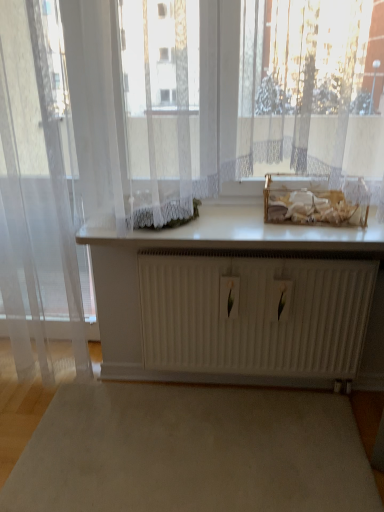
Question: Considering the relative positions of beige carpet at center and white glossy counter top at center in the image provided, is beige carpet at center in front of white glossy counter top at center?

Choices:
 (A) no
 (B) yes

Answer: (B)

Question: Does beige carpet at center appear on the left side of white glossy counter top at center?

Choices:
 (A) yes
 (B) no

Answer: (A)

Question: From the image's perspective, is beige carpet at center above white glossy counter top at center?

Choices:
 (A) yes
 (B) no

Answer: (B)

Question: Could you tell me if beige carpet at center is turned towards white glossy counter top at center?

Choices:
 (A) yes
 (B) no

Answer: (B)

Question: Is beige carpet at center at the right side of white glossy counter top at center?

Choices:
 (A) no
 (B) yes

Answer: (A)

Question: Is beige carpet at center positioned beyond the bounds of white glossy counter top at center?

Choices:
 (A) yes
 (B) no

Answer: (A)

Question: From a real-world perspective, is transparent fabric curtain at left under beige carpet at center?

Choices:
 (A) yes
 (B) no

Answer: (B)

Question: Is transparent fabric curtain at left at the right side of beige carpet at center?

Choices:
 (A) yes
 (B) no

Answer: (B)

Question: Are transparent fabric curtain at left and beige carpet at center located far from each other?

Choices:
 (A) yes
 (B) no

Answer: (B)

Question: Does transparent fabric curtain at left have a greater width compared to beige carpet at center?

Choices:
 (A) yes
 (B) no

Answer: (B)

Question: Is transparent fabric curtain at left closer to the viewer compared to beige carpet at center?

Choices:
 (A) no
 (B) yes

Answer: (B)

Question: Can beige carpet at center be found inside transparent fabric curtain at left?

Choices:
 (A) yes
 (B) no

Answer: (B)

Question: Would you say transparent fabric curtain at left is a long distance from white glossy counter top at center?

Choices:
 (A) yes
 (B) no

Answer: (B)